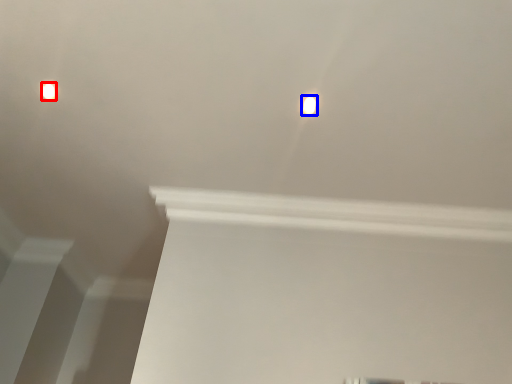
Question: Which object is closer to the camera taking this photo, lamp (highlighted by a red box) or lamp (highlighted by a blue box)?

Choices:
 (A) lamp
 (B) lamp

Answer: (B)